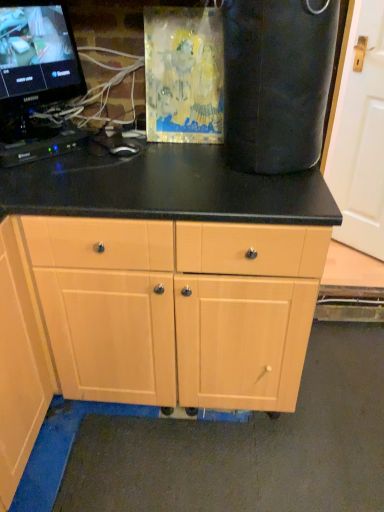
Where is `vacant space situated above light wood cabinet at center (from a real-world perspective)`? This screenshot has width=384, height=512. vacant space situated above light wood cabinet at center (from a real-world perspective) is located at coordinates [x=170, y=174].